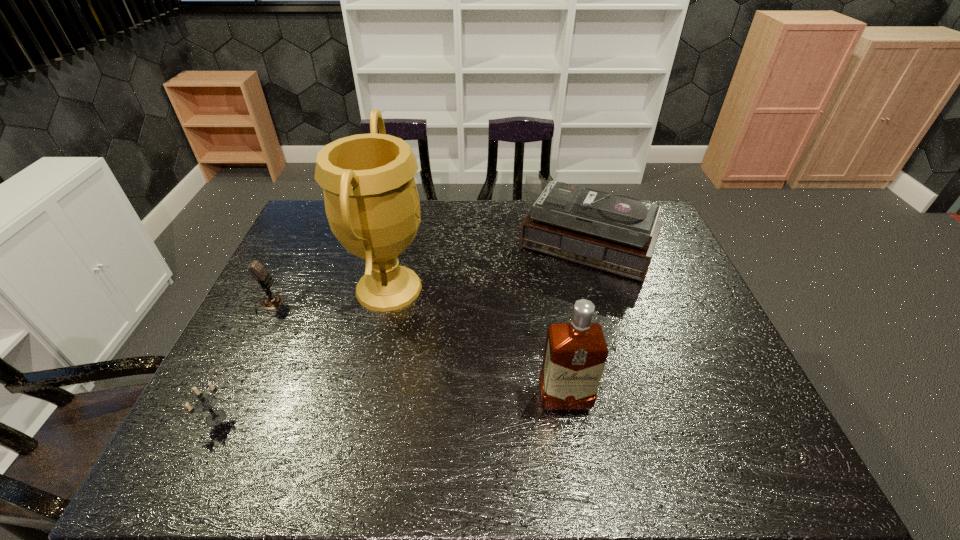
In the image, there is a desktop. Where is `vacant space at the near left corner`? The image size is (960, 540). vacant space at the near left corner is located at coordinates (194, 443).

Find the location of a particular element. The width and height of the screenshot is (960, 540). vacant space in between the record player and the candle holder is located at coordinates (402, 337).

Where is `free space between the microphone and the trophy`? This screenshot has height=540, width=960. free space between the microphone and the trophy is located at coordinates (328, 296).

Where is `vacant space in between the shortest object and the microphone`? vacant space in between the shortest object and the microphone is located at coordinates (242, 361).

Locate an element on the screen. This screenshot has height=540, width=960. vacant space that's between the third object from right to left and the fourth tallest object is located at coordinates (328, 296).

Locate an element on the screen. free space between the candle holder and the microphone is located at coordinates (242, 361).

Where is `blank region between the microphone and the record player`? This screenshot has width=960, height=540. blank region between the microphone and the record player is located at coordinates (428, 280).

Find the location of `vacant space that is in between the liquor and the microphone`. vacant space that is in between the liquor and the microphone is located at coordinates (417, 352).

Image resolution: width=960 pixels, height=540 pixels. I want to click on empty space that is in between the microphone and the shortest object, so click(242, 361).

Identify the location of empty space between the candle holder and the third object from left to right. (302, 353).